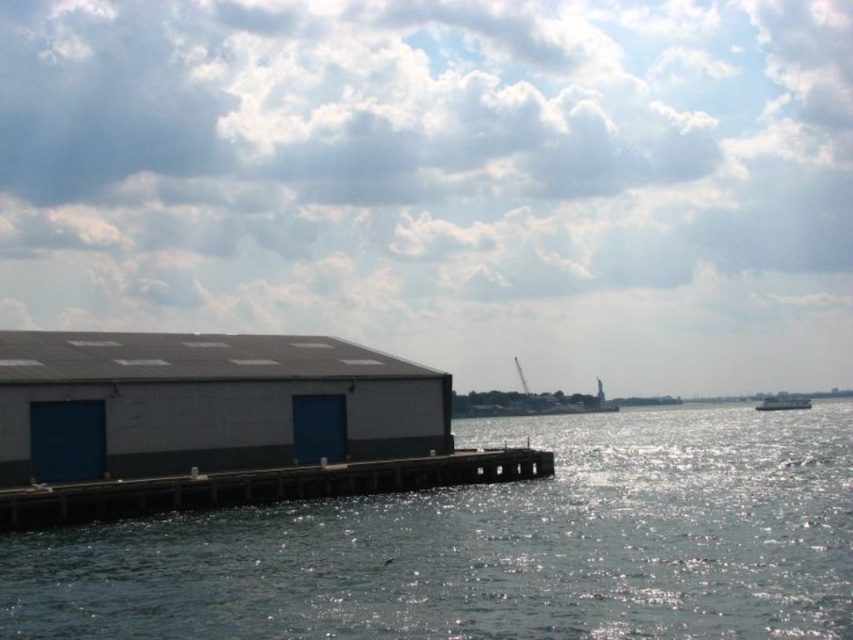
You are a photographer planning to capture the waterfront scene. You want to ensure that the glistening water at dock center and the white glossy boat at right are both visible in your shot. Given their sizes, which object should you prioritize framing closer to the center of the photo to maintain balance?

The glistening water at dock center should be prioritized closer to the center of the photo because its width is larger than the white glossy boat at right, making it a more dominant element in the scene.